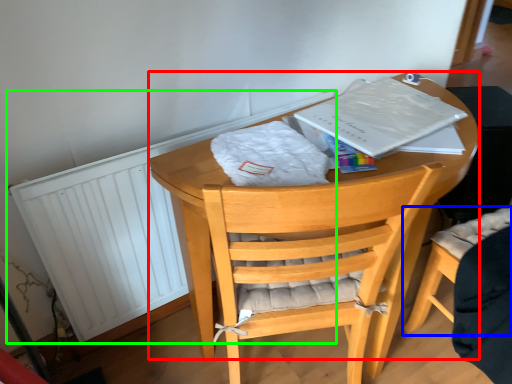
Question: Which object is the closest to the round table (highlighted by a red box)? Choose among these: chair (highlighted by a blue box) or radiator (highlighted by a green box).

Choices:
 (A) chair
 (B) radiator

Answer: (B)